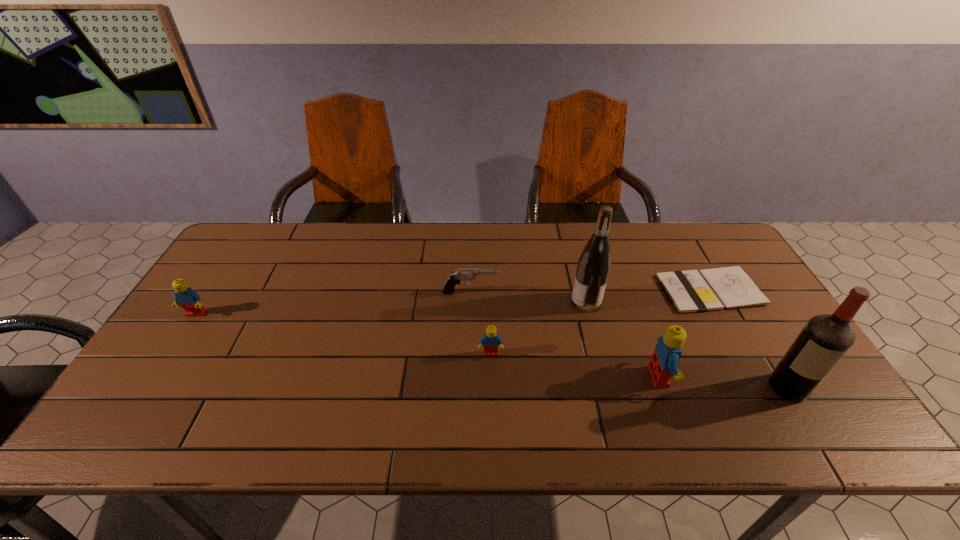
Where is `free spot located on the face of the shortest Lego`? free spot located on the face of the shortest Lego is located at coordinates (492, 389).

I want to click on vacant space located on the face of the rightmost Lego, so click(780, 377).

Where is `vacant region located 0.160m on the left of the shortest object`? The width and height of the screenshot is (960, 540). vacant region located 0.160m on the left of the shortest object is located at coordinates (608, 290).

This screenshot has height=540, width=960. What are the coordinates of `vacant space located 0.240m on the front of the wine bottle` in the screenshot? It's located at (607, 385).

Locate an element on the screen. Image resolution: width=960 pixels, height=540 pixels. free region located 0.270m at the muzzle of the gun is located at coordinates (589, 293).

In order to click on Lego situated at the near edge in this screenshot , I will do `click(665, 359)`.

Where is `liquor located at the near edge`? This screenshot has height=540, width=960. liquor located at the near edge is located at coordinates (825, 339).

The image size is (960, 540). I want to click on object at the left edge, so click(185, 296).

Locate an element on the screen. The image size is (960, 540). notepad that is at the right edge is located at coordinates [x=705, y=290].

At what (x,y) coordinates should I click in order to perform the action: click on liquor at the right edge. Please return your answer as a coordinate pair (x, y). This screenshot has height=540, width=960. Looking at the image, I should click on (825, 339).